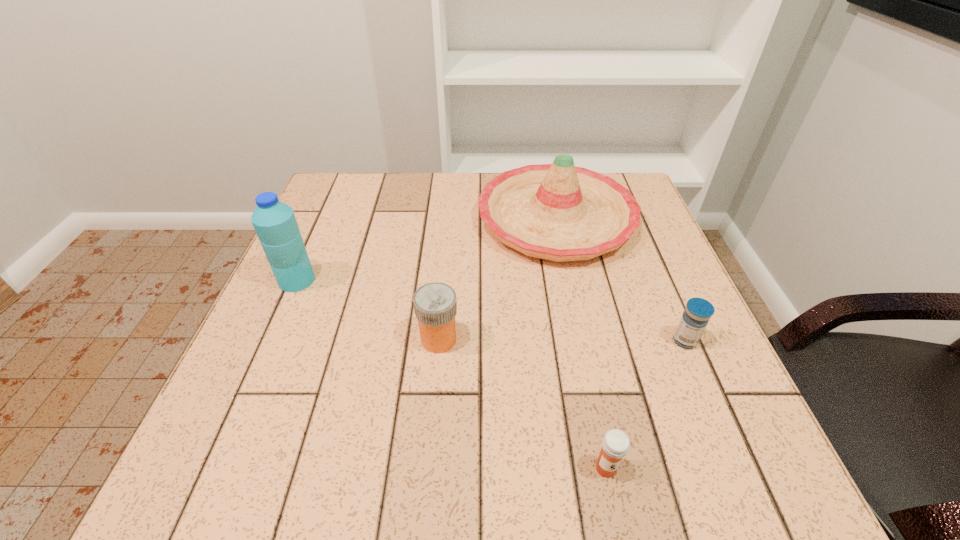
Image resolution: width=960 pixels, height=540 pixels. Identify the location of vacant area that lies between the rightmost medicine and the second tallest object. (620, 280).

Locate an element on the screen. The height and width of the screenshot is (540, 960). free space between the nearest object and the water bottle is located at coordinates (451, 374).

Locate an element on the screen. the fourth closest object to the tallest object is located at coordinates (698, 311).

I want to click on object that stands as the fourth closest to the rightmost medicine, so click(x=274, y=221).

Where is `medicine that is the second closest to the leftmost object`? The width and height of the screenshot is (960, 540). medicine that is the second closest to the leftmost object is located at coordinates (615, 444).

Where is `medicine that is the second closest one to the leftmost medicine`? This screenshot has height=540, width=960. medicine that is the second closest one to the leftmost medicine is located at coordinates click(x=698, y=311).

Locate an element on the screen. The width and height of the screenshot is (960, 540). vacant space that satisfies the following two spatial constraints: 1. on the front side of the rightmost medicine; 2. on the right side of the sombrero is located at coordinates (582, 341).

At what (x,y) coordinates should I click in order to perform the action: click on free space that satisfies the following two spatial constraints: 1. on the back side of the tallest object; 2. on the left side of the fourth shortest object. Please return your answer as a coordinate pair (x, y). This screenshot has height=540, width=960. Looking at the image, I should click on (324, 219).